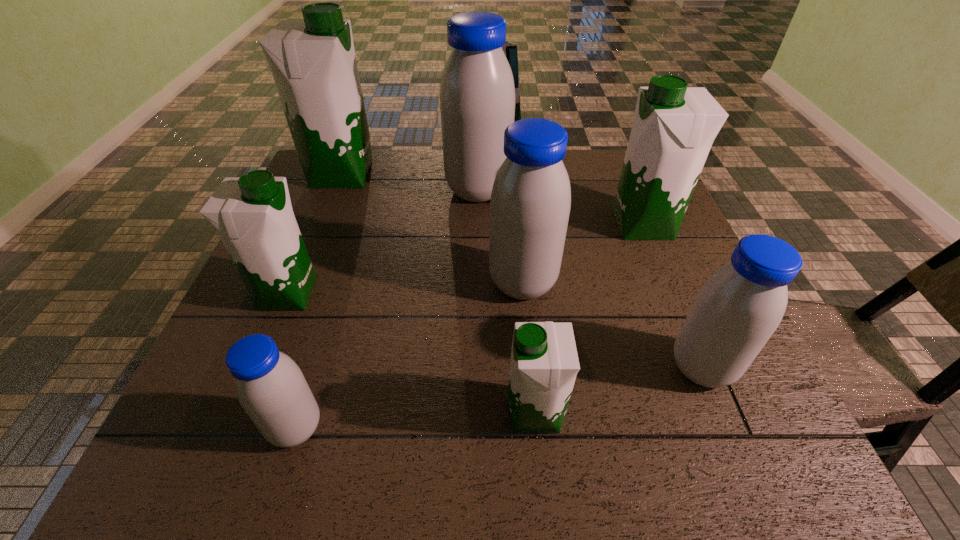
Point out which soya milk is positioned as the sixth nearest to the third smallest blue soya milk. Please provide its 2D coordinates. Your answer should be formatted as a tuple, i.e. [(x, y)], where the tuple contains the x and y coordinates of a point satisfying the conditions above.

[(253, 215)]

Select which green soya milk is the closest to the second nearest green soya milk. Please provide its 2D coordinates. Your answer should be formatted as a tuple, i.e. [(x, y)], where the tuple contains the x and y coordinates of a point satisfying the conditions above.

[(313, 63)]

Locate an element on the screen. the third closest green soya milk to the nearest green soya milk is located at coordinates (313, 63).

Point out which blue soya milk is positioned as the second nearest to the second nearest green soya milk. Please provide its 2D coordinates. Your answer should be formatted as a tuple, i.e. [(x, y)], where the tuple contains the x and y coordinates of a point satisfying the conditions above.

[(477, 96)]

Point out which blue soya milk is positioned as the second nearest to the third nearest blue soya milk. Please provide its 2D coordinates. Your answer should be formatted as a tuple, i.e. [(x, y)], where the tuple contains the x and y coordinates of a point satisfying the conditions above.

[(739, 307)]

Where is `free region that satisfies the following two spatial constraints: 1. on the back side of the leftmost blue soya milk; 2. on the front-facing side of the second smallest green soya milk`? This screenshot has width=960, height=540. free region that satisfies the following two spatial constraints: 1. on the back side of the leftmost blue soya milk; 2. on the front-facing side of the second smallest green soya milk is located at coordinates (338, 294).

Where is `free spot that satisfies the following two spatial constraints: 1. on the front-facing side of the second smallest blue soya milk; 2. on the left side of the third farthest green soya milk`? The image size is (960, 540). free spot that satisfies the following two spatial constraints: 1. on the front-facing side of the second smallest blue soya milk; 2. on the left side of the third farthest green soya milk is located at coordinates (256, 368).

Image resolution: width=960 pixels, height=540 pixels. Find the location of `free location that satisfies the following two spatial constraints: 1. on the front-facing side of the second farthest blue soya milk; 2. on the left side of the farthest green soya milk`. free location that satisfies the following two spatial constraints: 1. on the front-facing side of the second farthest blue soya milk; 2. on the left side of the farthest green soya milk is located at coordinates coord(297,283).

Find the location of a particular element. Image resolution: width=960 pixels, height=540 pixels. vacant space that satisfies the following two spatial constraints: 1. on the back side of the second biggest blue soya milk; 2. on the left side of the nearest blue soya milk is located at coordinates (341, 283).

Where is `free space that satisfies the following two spatial constraints: 1. on the front-facing side of the farthest blue soya milk; 2. on the left side of the farthest green soya milk`? Image resolution: width=960 pixels, height=540 pixels. free space that satisfies the following two spatial constraints: 1. on the front-facing side of the farthest blue soya milk; 2. on the left side of the farthest green soya milk is located at coordinates (335, 191).